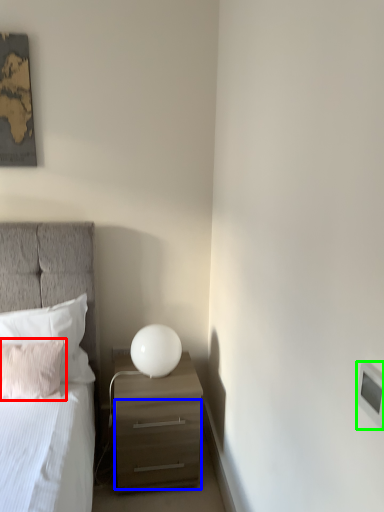
Question: Which is farther away from pillow (highlighted by a red box)? drawer (highlighted by a blue box) or light switch (highlighted by a green box)?

Choices:
 (A) drawer
 (B) light switch

Answer: (B)